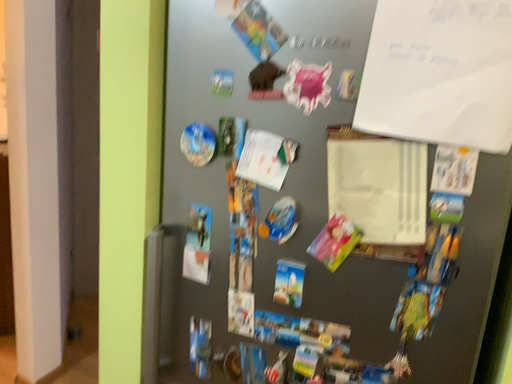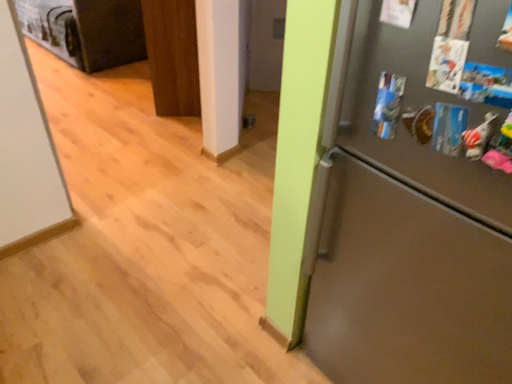
Question: Which way did the camera rotate in the video?

Choices:
 (A) rotated right
 (B) rotated left

Answer: (B)